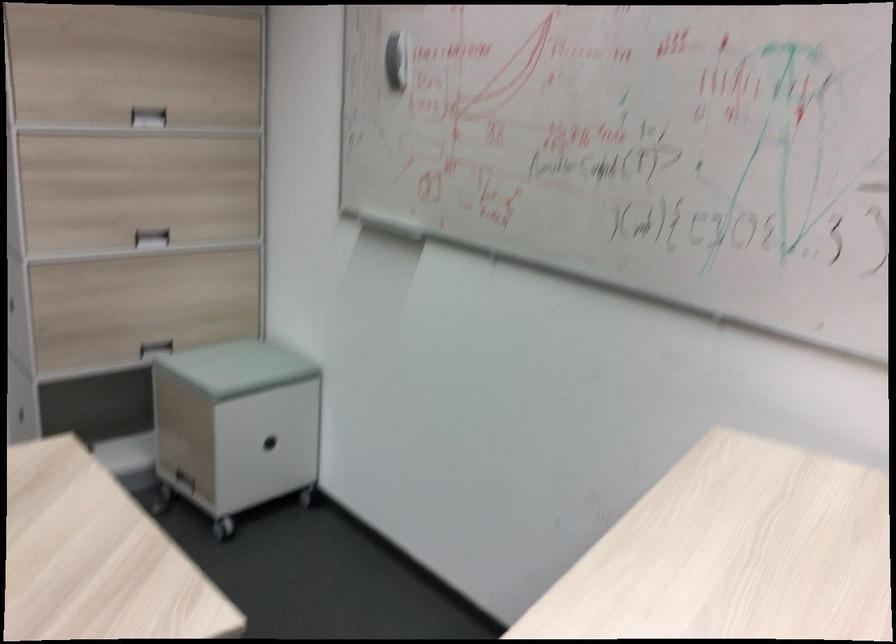
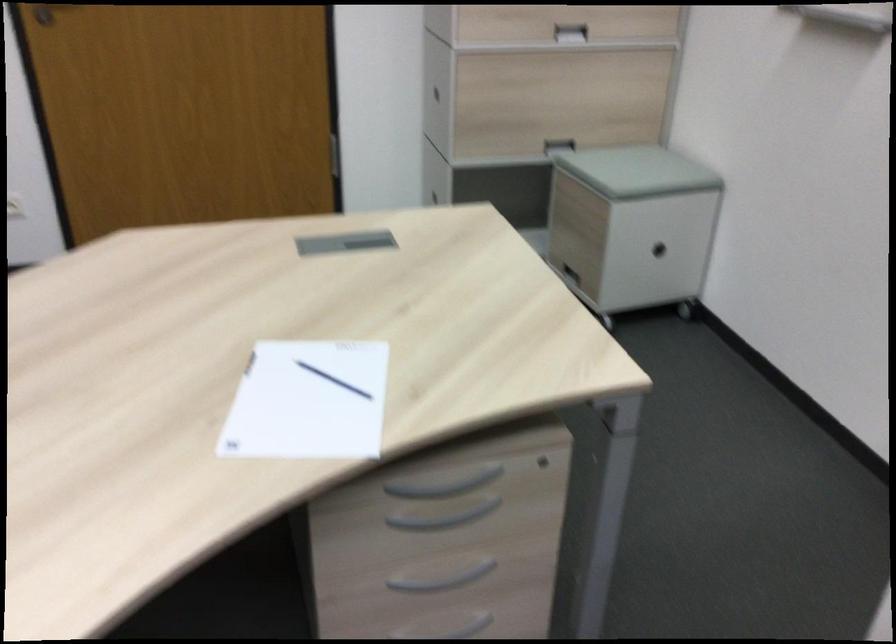
Find the pixel in the second image that matches (x=158, y=350) in the first image.

(557, 146)